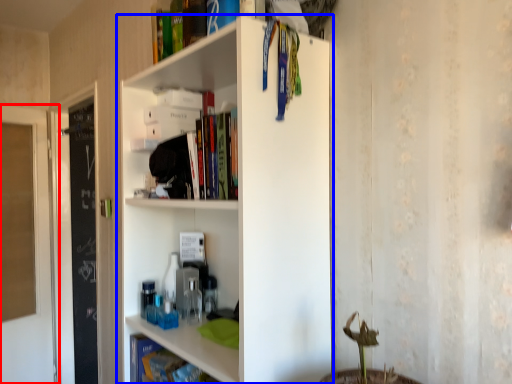
Question: Among these objects, which one is farthest to the camera, glass door (highlighted by a red box) or shelf (highlighted by a blue box)?

Choices:
 (A) glass door
 (B) shelf

Answer: (A)